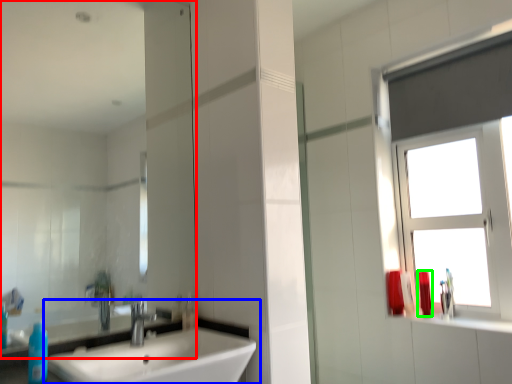
Question: Which object is positioned farthest from mirror (highlighted by a red box)? Select from sink (highlighted by a blue box) and toiletry (highlighted by a green box).

Choices:
 (A) sink
 (B) toiletry

Answer: (B)